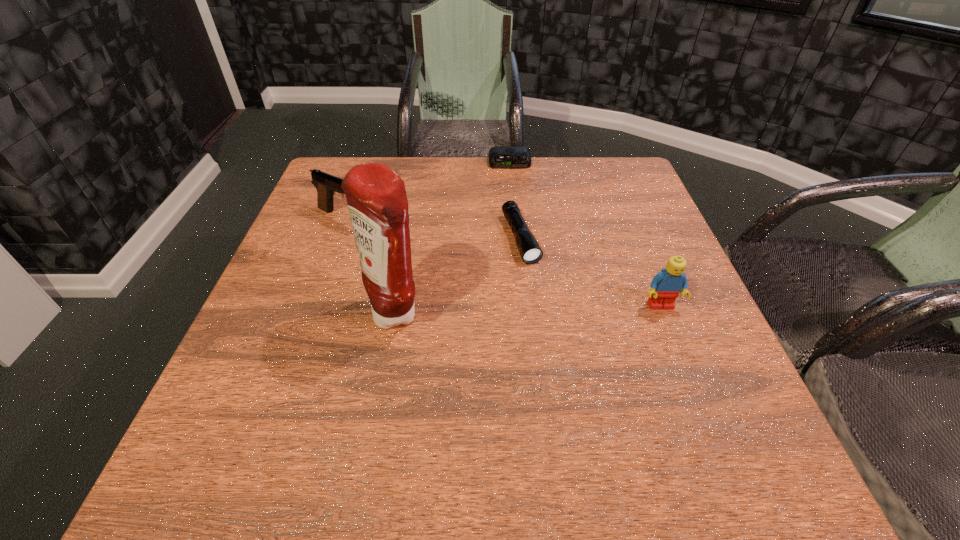
I want to click on free spot located 0.070m on the display of the alarm clock, so click(512, 183).

Find the location of a particular element. The height and width of the screenshot is (540, 960). vacant region located on the display of the alarm clock is located at coordinates (516, 214).

Locate an element on the screen. This screenshot has width=960, height=540. free space located 0.060m at the lens end of the second shortest object is located at coordinates (536, 284).

This screenshot has height=540, width=960. In order to click on vacant space located at the lens end of the second shortest object in this screenshot , I will do `click(572, 364)`.

You are a GUI agent. You are given a task and a screenshot of the screen. Output one action in this format:
    pyautogui.click(x=<x>, y=<y>)
    Task: Click on the vacant point located at the lens end of the second shortest object
    
    Given the screenshot: What is the action you would take?
    pyautogui.click(x=588, y=398)

Identify the location of blank space located at the muzzle of the pistol. Image resolution: width=960 pixels, height=540 pixels. pyautogui.click(x=499, y=277).

This screenshot has height=540, width=960. Find the location of `free space located 0.380m at the muzzle of the pistol`. free space located 0.380m at the muzzle of the pistol is located at coordinates (512, 282).

The height and width of the screenshot is (540, 960). Find the location of `vacant area situated 0.160m at the muzzle of the pistol`. vacant area situated 0.160m at the muzzle of the pistol is located at coordinates pyautogui.click(x=428, y=247).

Identify the location of object positioned at the far edge. (x=499, y=157).

At what (x,y) coordinates should I click in order to perform the action: click on object that is positioned at the left edge. Please return your answer as a coordinate pair (x, y). This screenshot has width=960, height=540. Looking at the image, I should click on (327, 185).